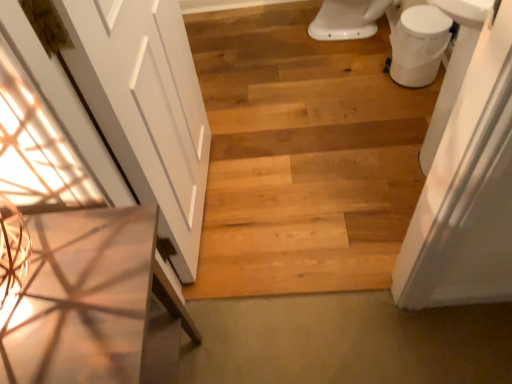
The height and width of the screenshot is (384, 512). I want to click on vacant space situated above natural wood floor at center (from a real-world perspective), so click(304, 117).